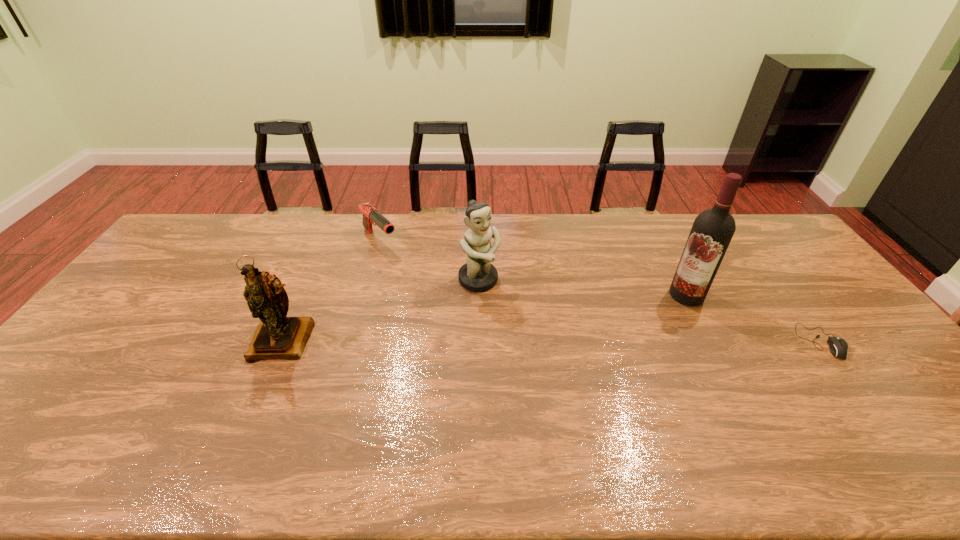
Identify the location of vacant region located on the front-facing side of the nearer figurine. This screenshot has height=540, width=960. (252, 414).

You are a GUI agent. You are given a task and a screenshot of the screen. Output one action in this format:
    pyautogui.click(x=<x>, y=<y>)
    Task: Click on the free space located 0.170m on the left of the rightmost object
    Image resolution: width=960 pixels, height=540 pixels.
    Given the screenshot: What is the action you would take?
    pyautogui.click(x=740, y=341)

Identify the location of free point located on the front-facing side of the right figurine. Image resolution: width=960 pixels, height=540 pixels. (508, 312).

Locate an element on the screen. vacant space located on the front-facing side of the right figurine is located at coordinates (504, 308).

Identify the location of free spot located 0.240m on the front-facing side of the right figurine. Image resolution: width=960 pixels, height=540 pixels. (536, 343).

Locate an element on the screen. free spot located 0.400m on the label of the wine bottle is located at coordinates (573, 353).

Locate an element on the screen. free space located 0.250m on the label of the wine bottle is located at coordinates (614, 332).

At what (x,y) coordinates should I click in order to perform the action: click on vacant region located 0.090m on the label of the wine bottle. Please return your answer as a coordinate pair (x, y). Looking at the image, I should click on (654, 312).

Find the location of a particular element. vacant space positioned 0.130m at the aiming end of the fourth tallest object is located at coordinates (410, 272).

The width and height of the screenshot is (960, 540). I want to click on vacant space located at the aiming end of the fourth tallest object, so (415, 276).